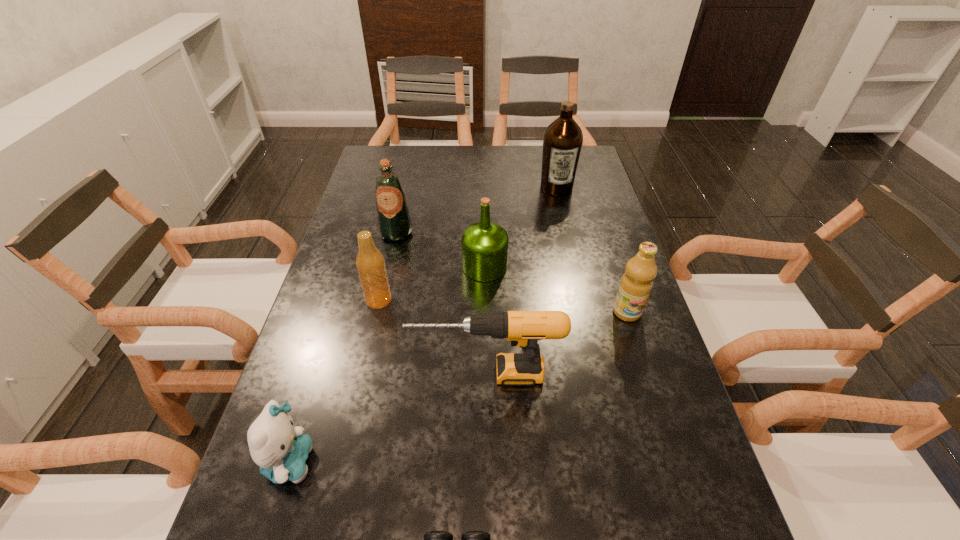
I want to click on the farthest olive oil, so click(562, 141).

Find the location of a particular element. the farthest object is located at coordinates (562, 141).

I want to click on the seventh nearest object, so click(394, 222).

Identify the location of the second farthest olive oil. The image size is (960, 540). (394, 222).

Locate an element on the screen. The width and height of the screenshot is (960, 540). the sixth nearest object is located at coordinates (484, 244).

Identify the location of the second olive oil from left to right. Image resolution: width=960 pixels, height=540 pixels. (484, 244).

Find the location of a particular element. Image resolution: width=960 pixels, height=540 pixels. beer bottle is located at coordinates (370, 263).

This screenshot has height=540, width=960. I want to click on the rightmost olive oil, so click(636, 284).

Image resolution: width=960 pixels, height=540 pixels. Identify the location of the rightmost object. (636, 284).

Locate an element on the screen. Image resolution: width=960 pixels, height=540 pixels. drill is located at coordinates (523, 328).